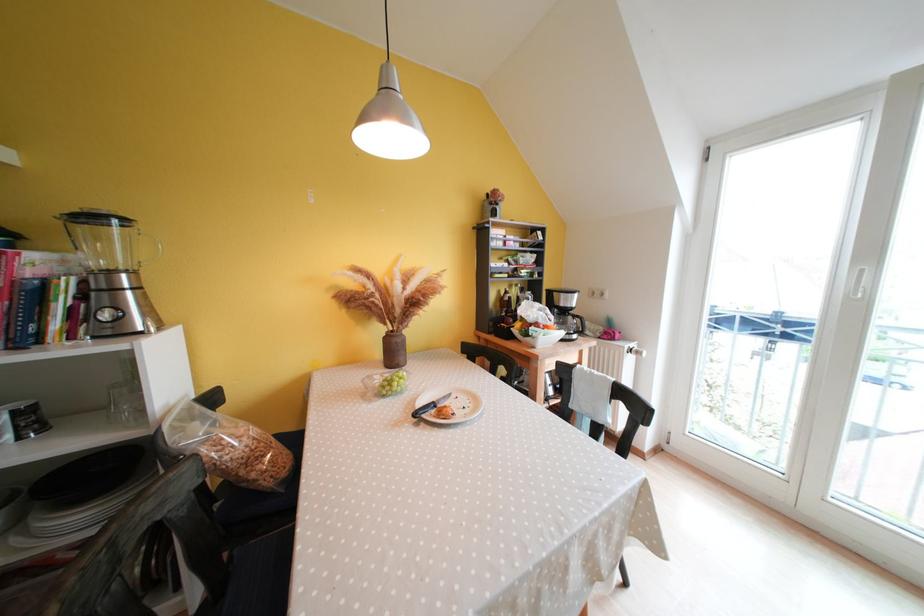
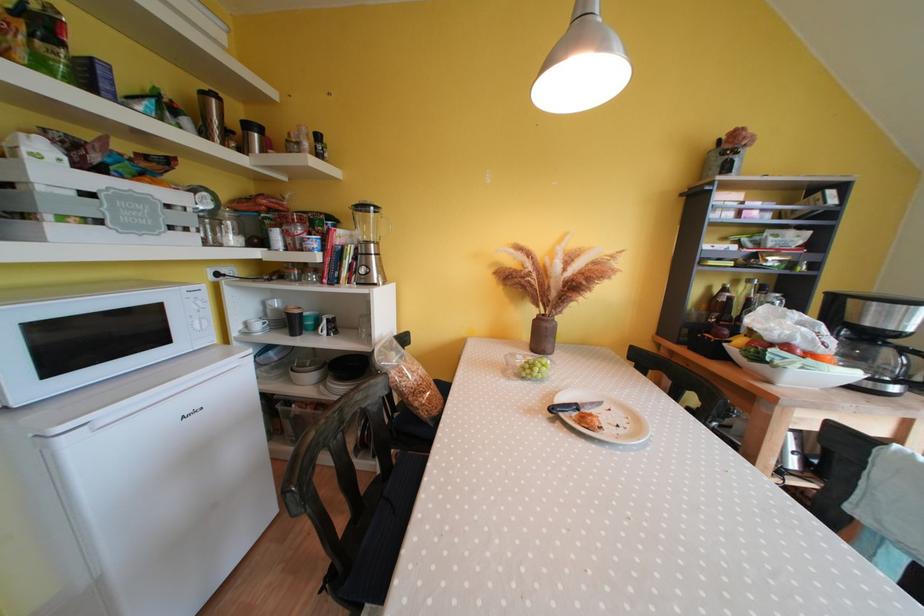
The point at (405, 344) is marked in the first image. Where is the corresponding point in the second image?

(554, 330)